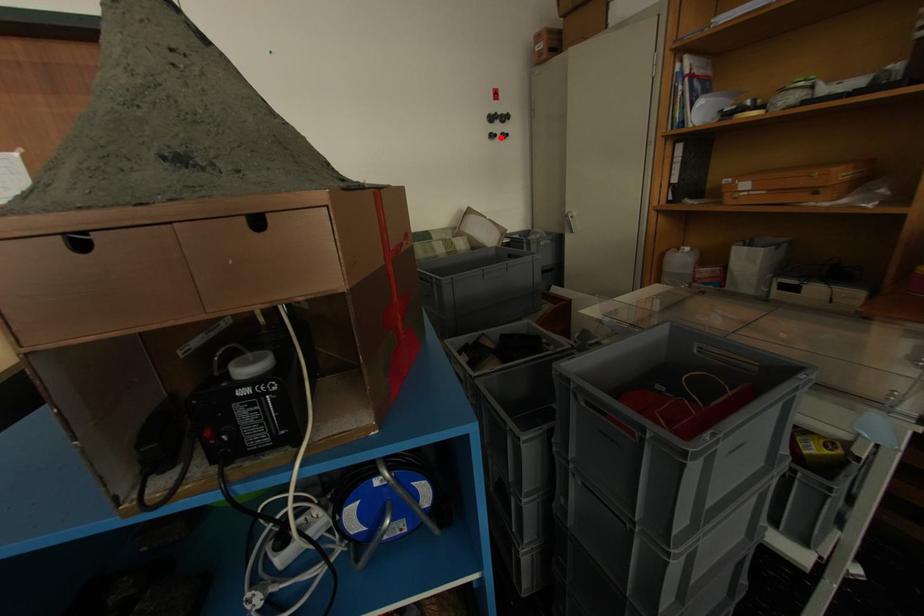
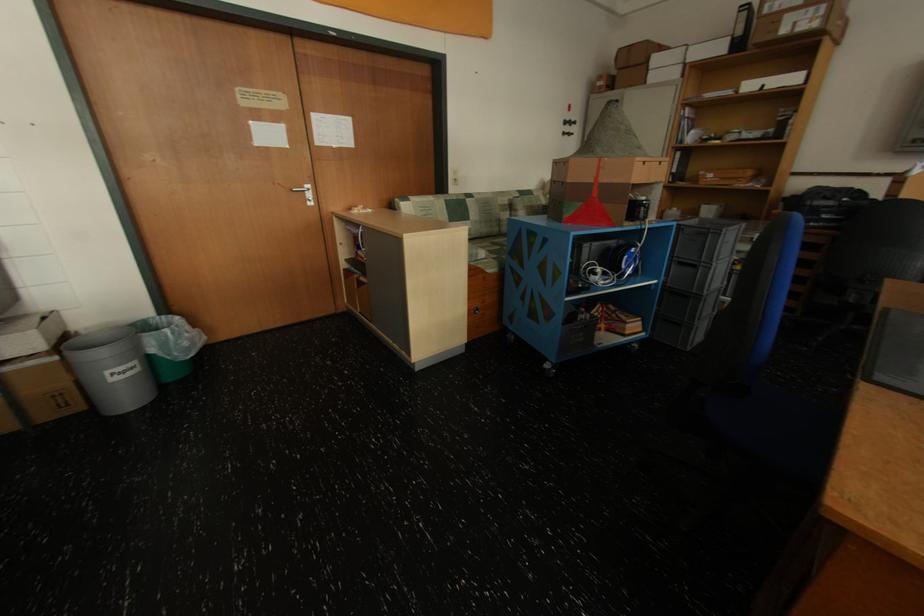
Where in the second image is the point corresponding to the highlighted location from the first image?

(573, 135)